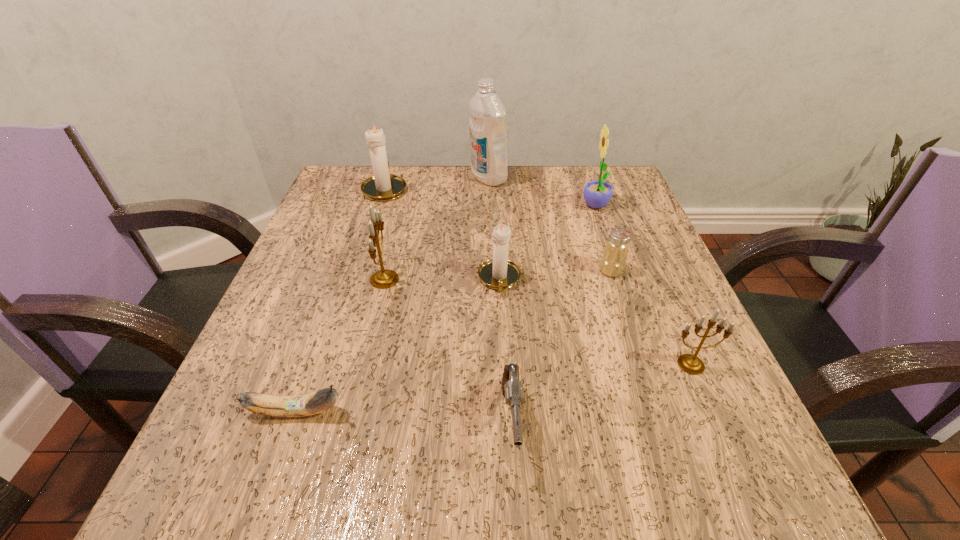
What are the coordinates of `white detergent` in the screenshot? It's located at (487, 117).

Image resolution: width=960 pixels, height=540 pixels. I want to click on detergent, so click(x=487, y=117).

Where is `sunflower`? This screenshot has height=540, width=960. sunflower is located at coordinates (597, 193).

Where is `the left white candle holder`? the left white candle holder is located at coordinates (383, 186).

I want to click on the farthest candelabrum, so click(383, 186).

I want to click on the farther gold candelabrum, so click(x=384, y=278).

Locate an element on the screen. This screenshot has width=960, height=540. the left gold candelabrum is located at coordinates (384, 278).

The width and height of the screenshot is (960, 540). In order to click on the right white candle holder in this screenshot , I will do `click(499, 273)`.

At what (x,y) coordinates should I click in order to perform the action: click on the nearer white candle holder. Please return your answer as a coordinate pair (x, y). Looking at the image, I should click on (499, 273).

The image size is (960, 540). Identify the location of the seventh farthest object. (689, 363).